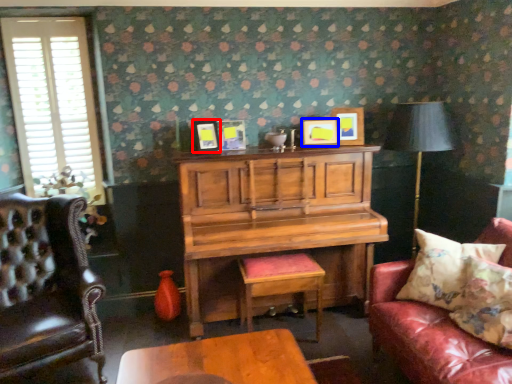
Question: Which point is further to the camera, picture frame (highlighted by a red box) or picture frame (highlighted by a blue box)?

Choices:
 (A) picture frame
 (B) picture frame

Answer: (B)